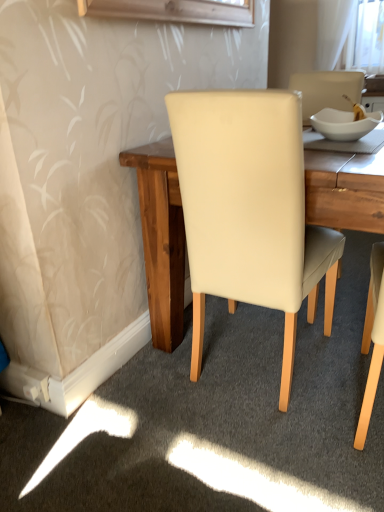
Describe the element at coordinates (249, 211) in the screenshot. The width and height of the screenshot is (384, 512). I see `cream leather chair at center` at that location.

The width and height of the screenshot is (384, 512). Identify the location of cream leather chair at center. (249, 211).

In order to face cream leather chair at center, should I rotate leftwards or rightwards?

You should look right and rotate roughly 9.354 degrees.

The width and height of the screenshot is (384, 512). Describe the element at coordinates (344, 124) in the screenshot. I see `white glossy bowl at upper right` at that location.

Identify the location of white glossy bowl at upper right. Image resolution: width=384 pixels, height=512 pixels. (344, 124).

This screenshot has height=512, width=384. I want to click on cream leather chair at center, so click(x=249, y=211).

Can you confirm if white glossy bowl at upper right is positioned to the right of cream leather chair at center?

Correct, you'll find white glossy bowl at upper right to the right of cream leather chair at center.

Between white glossy bowl at upper right and cream leather chair at center, which one is positioned in front?

cream leather chair at center is closer to the camera.

Does point (336, 123) appear closer or farther from the camera than point (235, 291)?

Clearly, point (336, 123) is more distant from the camera than point (235, 291).

From the image's perspective, between white glossy bowl at upper right and cream leather chair at center, who is located below?

cream leather chair at center.

From a real-world perspective, who is located lower, white glossy bowl at upper right or cream leather chair at center?

In real-world perspective, cream leather chair at center is lower.

Does white glossy bowl at upper right have a lesser width compared to cream leather chair at center?

Yes, white glossy bowl at upper right is thinner than cream leather chair at center.

From their relative heights in the image, would you say white glossy bowl at upper right is taller or shorter than cream leather chair at center?

Considering their sizes, white glossy bowl at upper right has less height than cream leather chair at center.

In terms of size, does white glossy bowl at upper right appear bigger or smaller than cream leather chair at center?

white glossy bowl at upper right is smaller than cream leather chair at center.

Is white glossy bowl at upper right spatially inside cream leather chair at center, or outside of it?

white glossy bowl at upper right is contained in cream leather chair at center.

Are white glossy bowl at upper right and cream leather chair at center making contact?

There is a gap between white glossy bowl at upper right and cream leather chair at center.

Is cream leather chair at center at the back of white glossy bowl at upper right?

Yes, white glossy bowl at upper right is facing away from cream leather chair at center.

Where is `bowl lying on the right of cream leather chair at center`? The image size is (384, 512). bowl lying on the right of cream leather chair at center is located at coordinates (344, 124).

Between cream leather chair at center and white glossy bowl at upper right, which one appears on the right side from the viewer's perspective?

white glossy bowl at upper right.

Which object is closer to the camera taking this photo, cream leather chair at center or white glossy bowl at upper right?

cream leather chair at center is in front.

Is point (214, 278) farther from viewer compared to point (339, 137)?

Yes, it is behind point (339, 137).

In the scene shown: From the image's perspective, which is above, cream leather chair at center or white glossy bowl at upper right?

white glossy bowl at upper right, from the image's perspective.

From a real-world perspective, is cream leather chair at center physically located above or below white glossy bowl at upper right?

From a real-world perspective, cream leather chair at center is physically below white glossy bowl at upper right.

Which object is wider, cream leather chair at center or white glossy bowl at upper right?

Wider between the two is cream leather chair at center.

From their relative heights in the image, would you say cream leather chair at center is taller or shorter than white glossy bowl at upper right?

Considering their sizes, cream leather chair at center has more height than white glossy bowl at upper right.

Between cream leather chair at center and white glossy bowl at upper right, which one has smaller size?

white glossy bowl at upper right.

Is cream leather chair at center inside the boundaries of white glossy bowl at upper right, or outside?

cream leather chair at center lies outside white glossy bowl at upper right.

Are cream leather chair at center and white glossy bowl at upper right making contact?

No, cream leather chair at center is not beside white glossy bowl at upper right.

Is cream leather chair at center aimed at white glossy bowl at upper right?

Yes, cream leather chair at center faces towards white glossy bowl at upper right.

How different are the orientations of cream leather chair at center and white glossy bowl at upper right in degrees?

There is a 92.7-degree angle between the facing directions of cream leather chair at center and white glossy bowl at upper right.

The height and width of the screenshot is (512, 384). Identify the location of chair that is under the white glossy bowl at upper right (from a real-world perspective). (249, 211).

The height and width of the screenshot is (512, 384). Find the location of `chair that is under the white glossy bowl at upper right (from a real-world perspective)`. chair that is under the white glossy bowl at upper right (from a real-world perspective) is located at coordinates (249, 211).

Image resolution: width=384 pixels, height=512 pixels. What are the coordinates of `chair lying below the white glossy bowl at upper right (from the image's perspective)` in the screenshot? It's located at (249, 211).